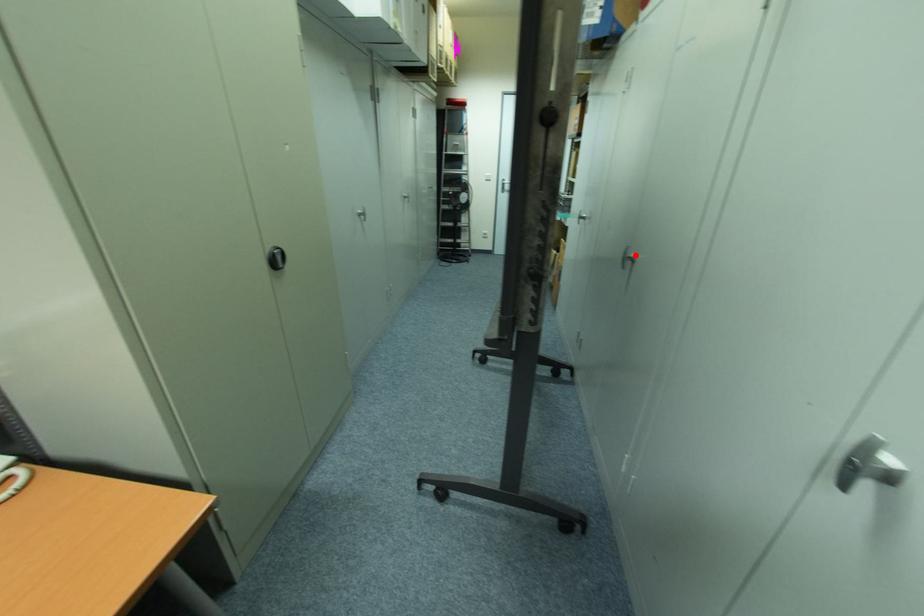
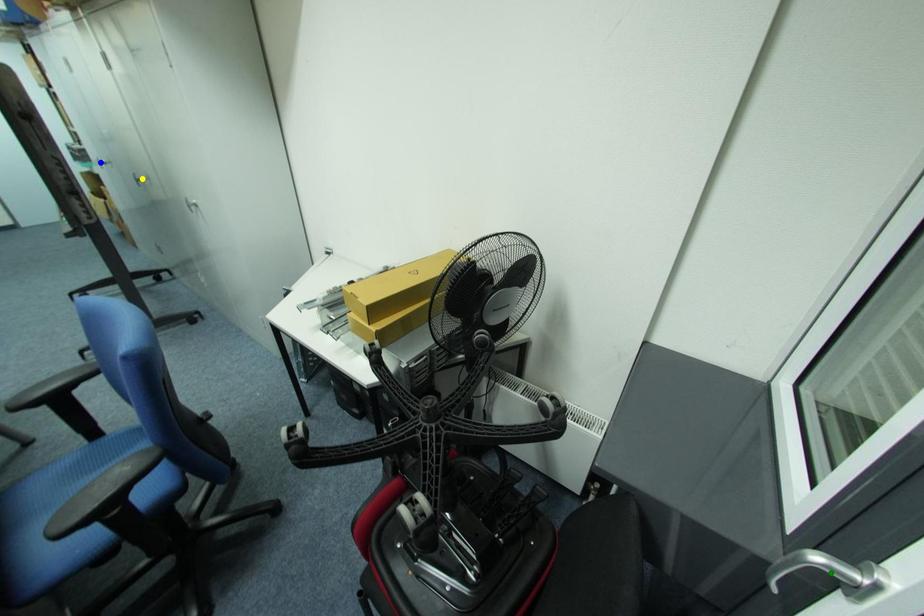
Question: I am providing you with two images of the same scene from different viewpoints. A red point is marked on the first image. You are given multiple points on the second image. Which mark in image 2 goes with the point in image 1?

Choices:
 (A) yellow point
 (B) blue point
 (C) green point

Answer: (A)